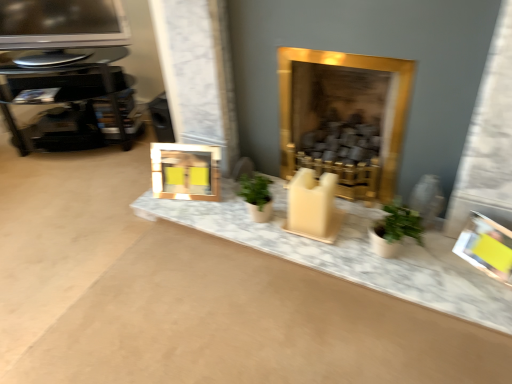
This screenshot has width=512, height=384. Identify the location of free space in front of black glass table at left. (71, 186).